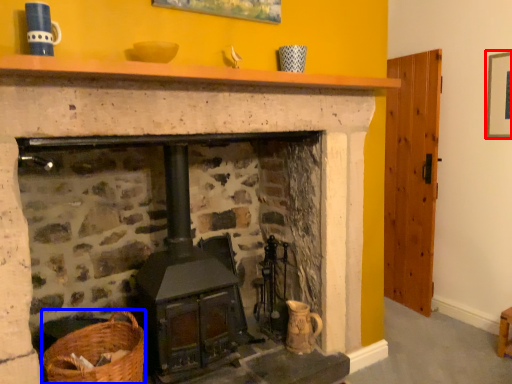
Question: Which of the following is the farthest to the observer, picture frame (highlighted by a red box) or basket (highlighted by a blue box)?

Choices:
 (A) picture frame
 (B) basket

Answer: (A)